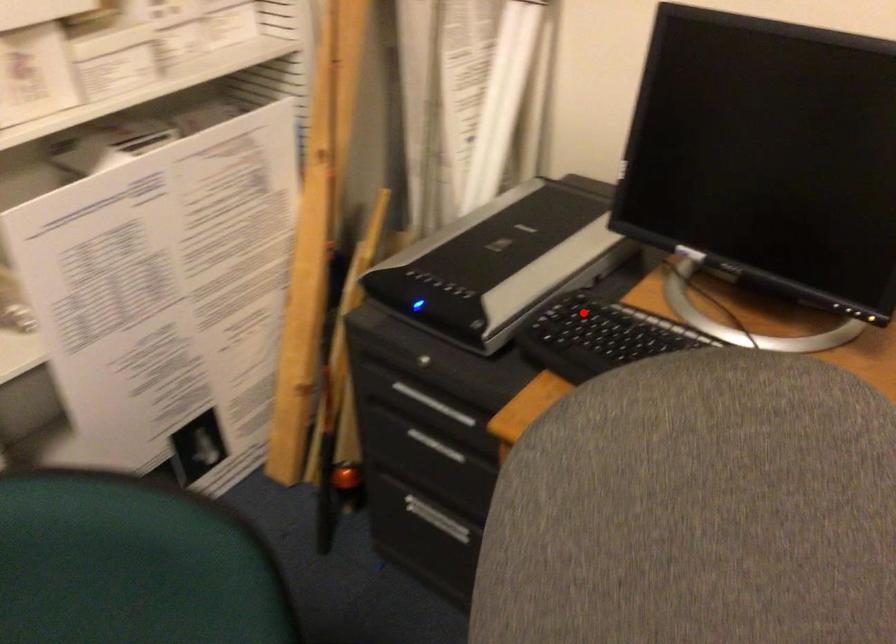
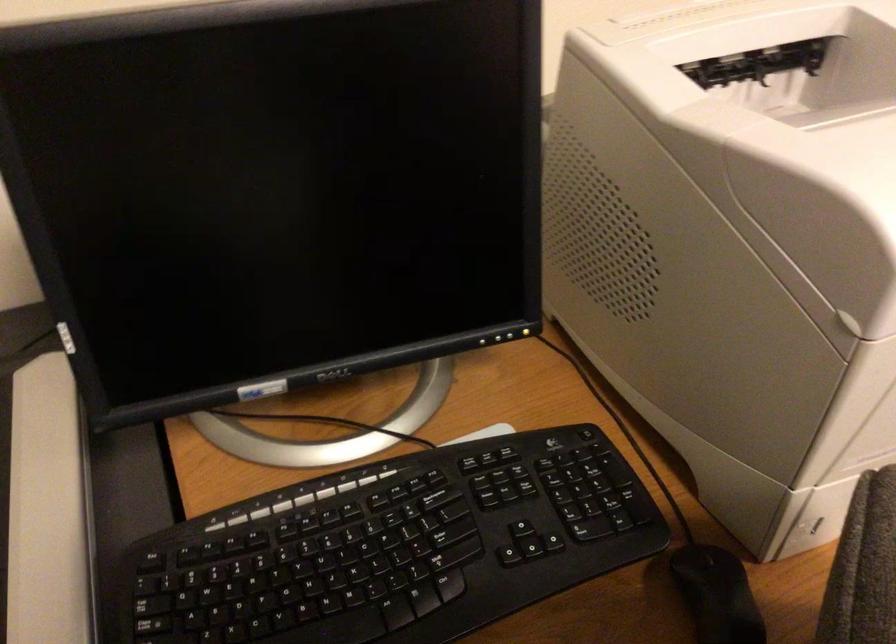
Question: I am providing you with two images of the same scene from different viewpoints. Given a red point in image1, look at the same physical point in image2. Is it:

Choices:
 (A) Closer to the viewpoint
 (B) Farther from the viewpoint

Answer: (A)